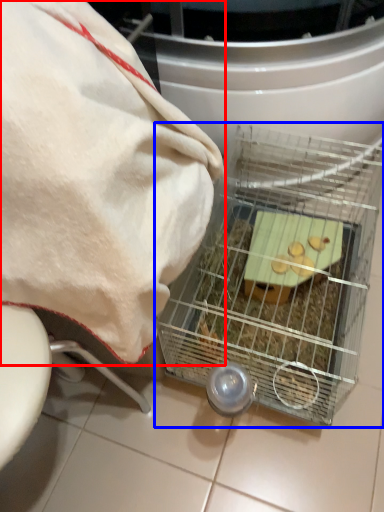
Question: Which of the following is the farthest to the observer, towel (highlighted by a red box) or appliance (highlighted by a blue box)?

Choices:
 (A) towel
 (B) appliance

Answer: (B)